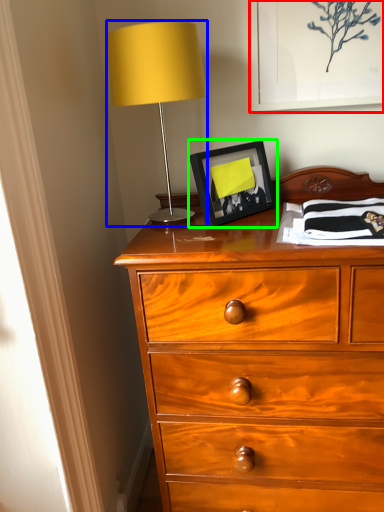
Question: Which object is positioned farthest from picture frame (highlighted by a red box)? Select from table lamp (highlighted by a blue box) and picture frame (highlighted by a green box).

Choices:
 (A) table lamp
 (B) picture frame

Answer: (A)